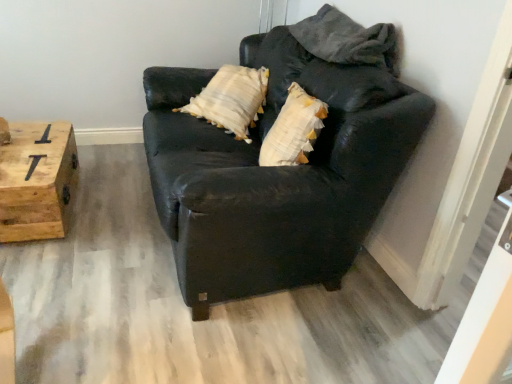
Find the location of `free space above wooden crate at left (from a real-world perspective)`. free space above wooden crate at left (from a real-world perspective) is located at coordinates (22, 153).